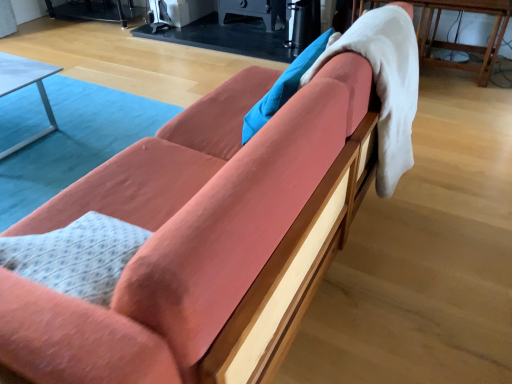
Question: Looking at their shapes, would you say white fluffy blanket at upper right is wider or thinner than metallic silver table at left, which ranks as the first table in bottom-to-top order?

Choices:
 (A) wide
 (B) thin

Answer: (B)

Question: Based on their positions, is white fluffy blanket at upper right located to the left or right of metallic silver table at left, the 1th table from the left?

Choices:
 (A) right
 (B) left

Answer: (A)

Question: Which object is positioned closest to the wooden table at right, the 2th table from the left?

Choices:
 (A) white fluffy blanket at upper right
 (B) metallic silver table at left, the 1th table from the left

Answer: (A)

Question: Which object is positioned farthest from the white fluffy blanket at upper right?

Choices:
 (A) wooden table at right, arranged as the 2th table when ordered from the bottom
 (B) metallic silver table at left, which ranks as the first table in bottom-to-top order

Answer: (B)